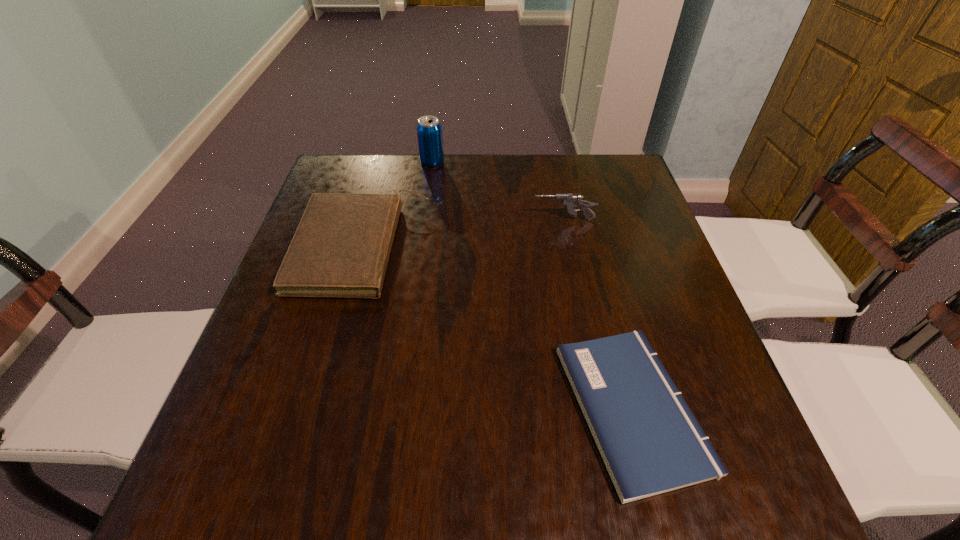
Image resolution: width=960 pixels, height=540 pixels. What are the coordinates of `vacant area at the left edge of the desktop` in the screenshot? It's located at (236, 455).

Find the location of a particular element. The height and width of the screenshot is (540, 960). free region at the right edge of the desktop is located at coordinates (642, 227).

This screenshot has height=540, width=960. In the image, there is a desktop. Find the location of `vacant space at the far left corner`. vacant space at the far left corner is located at coordinates (372, 157).

Find the location of `free space at the far right corner of the desktop`. free space at the far right corner of the desktop is located at coordinates (586, 165).

Where is `vacant area between the shortest object and the farther paperback book`? The width and height of the screenshot is (960, 540). vacant area between the shortest object and the farther paperback book is located at coordinates (496, 328).

Locate an element on the screen. This screenshot has width=960, height=540. vacant space that is in between the farthest object and the third shortest object is located at coordinates (498, 192).

At what (x,y) coordinates should I click in order to perform the action: click on free area in between the third shortest object and the right paperback book. Please return your answer as a coordinate pair (x, y). The height and width of the screenshot is (540, 960). Looking at the image, I should click on (598, 314).

The height and width of the screenshot is (540, 960). I want to click on vacant space that is in between the left paperback book and the shortest object, so click(x=496, y=328).

Find the location of a particular element. The height and width of the screenshot is (540, 960). vacant space in between the farther paperback book and the shorter paperback book is located at coordinates (496, 328).

The height and width of the screenshot is (540, 960). I want to click on empty space between the third shortest object and the farthest object, so click(498, 192).